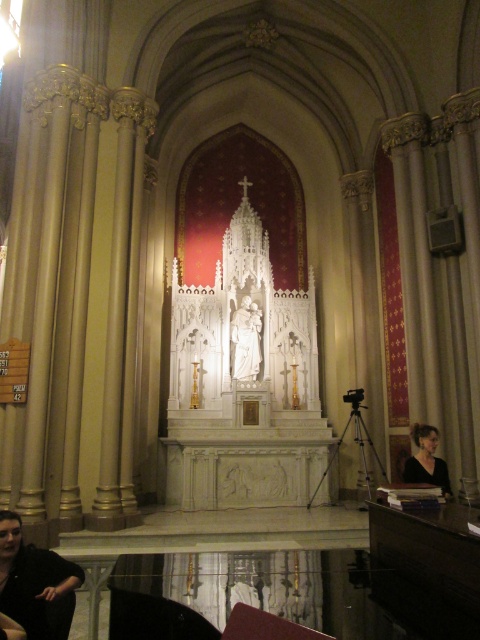
You are an interior designer planning to install a new lighting fixture above the altar. You notice the black fabric woman at lower left and the black matte dress at lower right. Which object should you avoid placing the light directly above to prevent casting a shadow on the altar?

You should avoid placing the light directly above the black fabric woman at lower left because it is located below the black matte dress at lower right, so its shadow would fall on the altar.

You are standing in the grand cathedral and want to take a photo of the white altar at the center. There is a black fabric woman at lower left blocking your view. Can you move to the right to get an unobstructed view of the white altar at the center?

The black fabric woman at lower left is positioned at point (36, 582), which is near the lower left corner of the image. Moving to the right would likely provide a clearer view of the white altar at the center as you move away from the obstruction.

You are an interior designer observing the church scene. You need to place a 1.2 meter tall decorative column between the black fabric woman at lower left and the black matte dress at lower right. Based on their heights, will the column be taller than both objects?

The black fabric woman at lower left has a greater height compared to the black matte dress at lower right. Since the column is 1.2 meters tall, we need to compare it to both objects. However, the exact heights of the woman and the dress are not provided. Therefore, it is impossible to determine if the column will be taller than both objects without additional information.